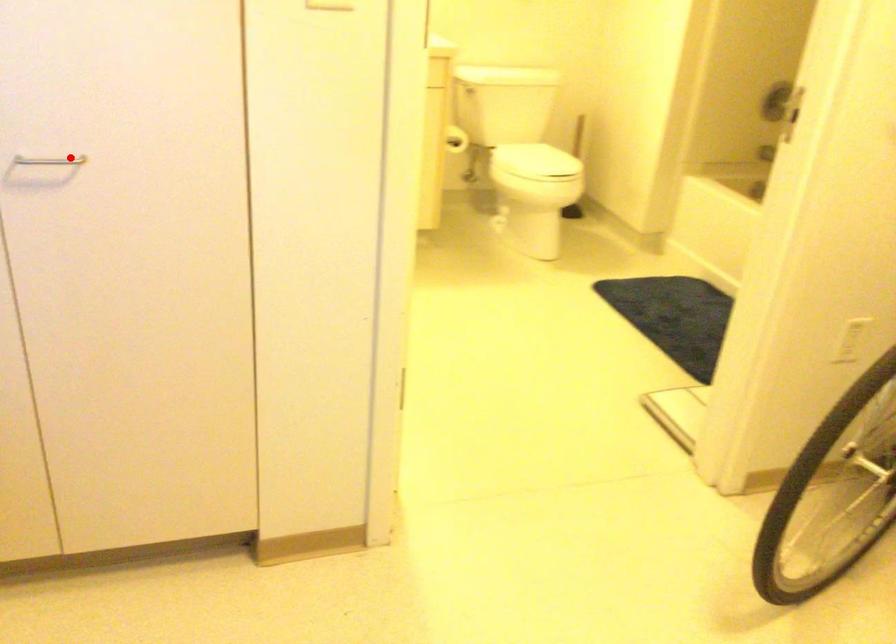
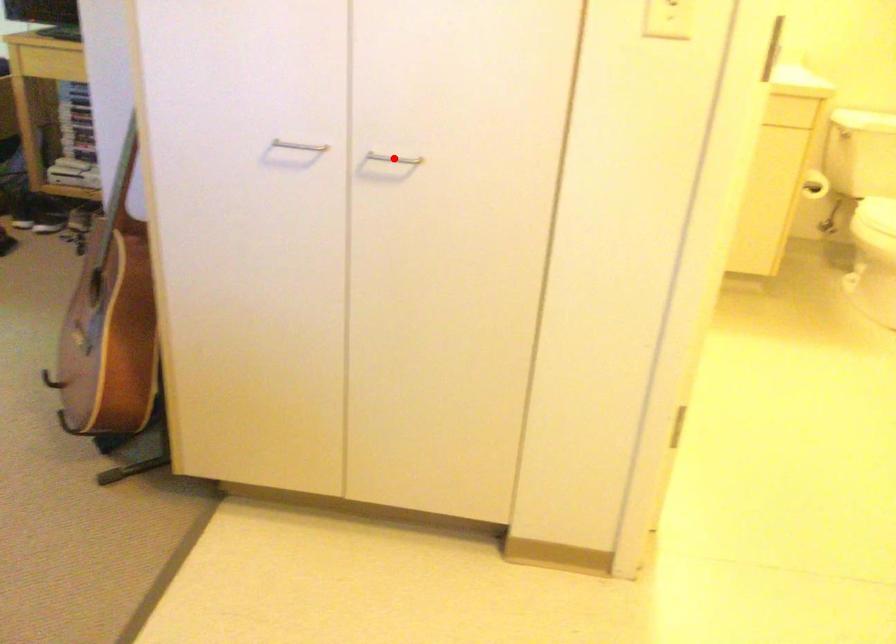
From the picture: I am providing you with two images of the same scene from different viewpoints. A red point is marked on the first image and another point is marked on the second image. Is the marked point in image1 the same physical position as the marked point in image2?

Yes